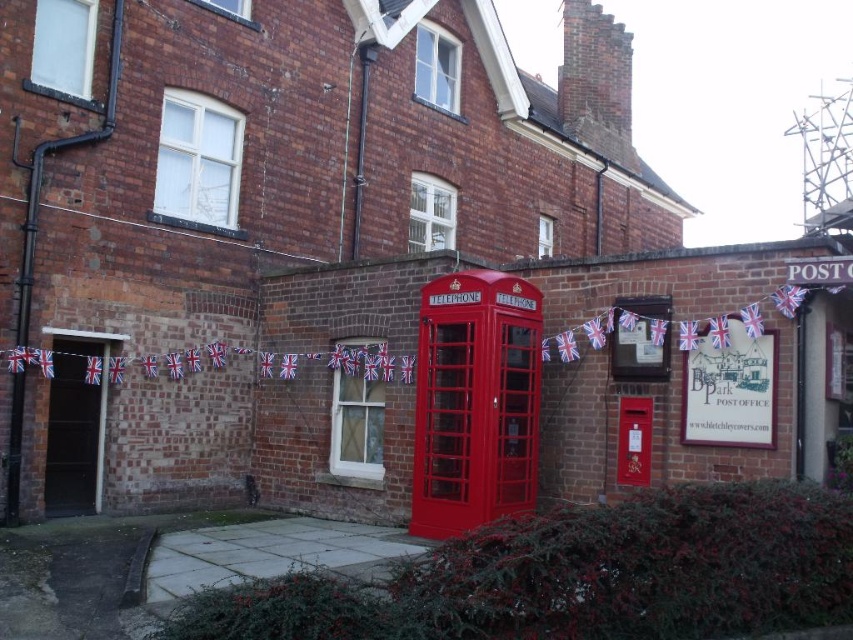
You are standing in front of the brick building and notice two points marked on the facade. Which point is closer to you, point [422,326] or point [635,483]?

Point [635,483] is closer to you because it is in front of point [422,326].

You are a delivery person with a cart that is 2 meters wide. You need to pass between the matte red telephone box at center and metallic red telephone box at center. Can your cart fit through the space between them?

The distance between the matte red telephone box at center and metallic red telephone box at center is 2.16 meters. Since your cart is 2 meters wide, it can fit through the space as there is enough clearance.

In the scene shown: You are a photographer standing at the camera position. You want to take a photo of the matte red telephone box at center so that it fills the frame without cropping any part of it. Given that your camera has a standard lens with a focal length of 50mm, what is the minimum distance you need to be from the telephone box to achieve this?

The matte red telephone box at center is 11.15 meters away from the camera. To fill the frame without cropping, you need to be at least 11.15 meters away from it.